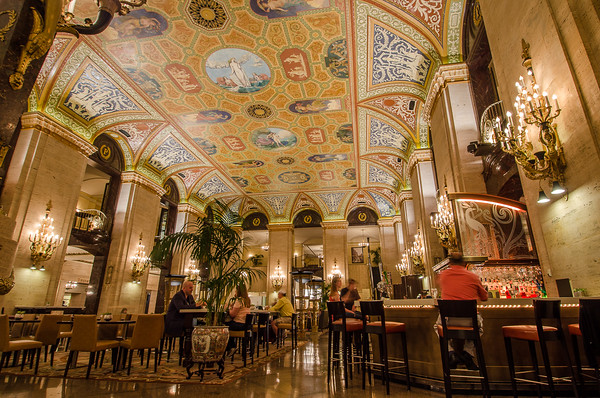
Find the location of a particular element. Image resolution: width=600 pixels, height=398 pixels. plant is located at coordinates (216, 269), (378, 256), (259, 259), (321, 294).